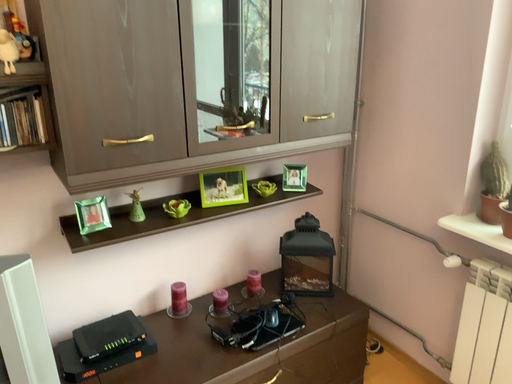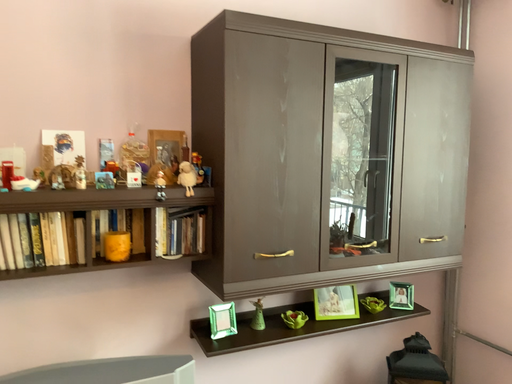
Question: How did the camera likely rotate when shooting the video?

Choices:
 (A) rotated upward
 (B) rotated downward

Answer: (A)